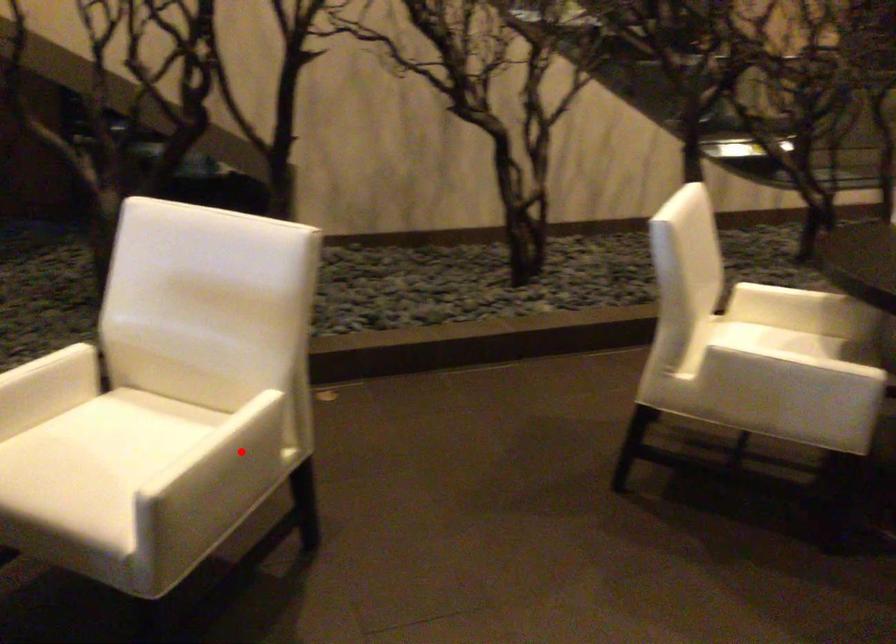
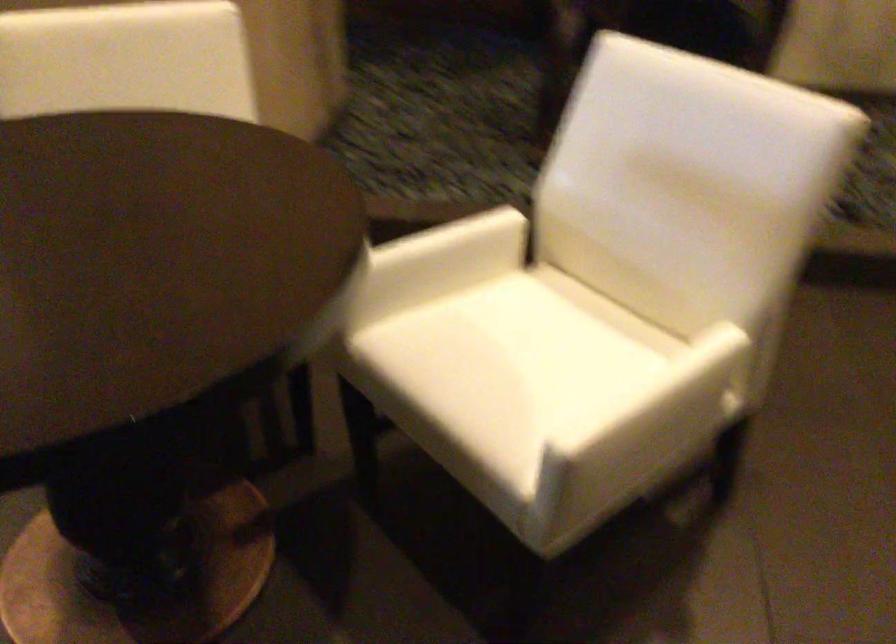
Question: I am providing you with two images of the same scene from different viewpoints. A red point is shown in image1. For the corresponding object point in image2, is it positioned nearer or farther from the camera?

Choices:
 (A) Nearer
 (B) Farther

Answer: (A)